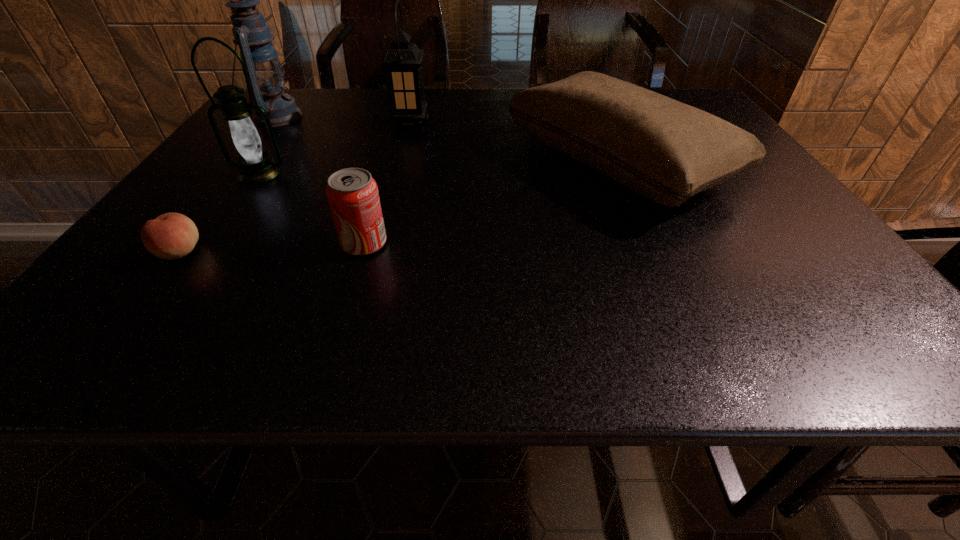
Where is `vacant region between the soda can and the nearest lantern`? vacant region between the soda can and the nearest lantern is located at coordinates (312, 208).

Identify the location of free space between the nearest lantern and the shortest object. The height and width of the screenshot is (540, 960). (220, 212).

Locate an element on the screen. Image resolution: width=960 pixels, height=540 pixels. object that stands as the closest to the cushion is located at coordinates (402, 62).

This screenshot has width=960, height=540. In order to click on object that is the fourth closest one to the shortest object in this screenshot , I will do `click(402, 62)`.

Identify which lantern is located as the third nearest to the shortest object. Please provide its 2D coordinates. Your answer should be formatted as a tuple, i.e. [(x, y)], where the tuple contains the x and y coordinates of a point satisfying the conditions above.

[(402, 62)]

This screenshot has width=960, height=540. Identify the location of lantern that is the closest to the shortest object. (255, 166).

The width and height of the screenshot is (960, 540). Identify the location of vacant space that satisfies the following two spatial constraints: 1. on the side where the nearest lantern emits light; 2. on the right side of the soda can. (211, 244).

Identify the location of free spot that satisfies the following two spatial constraints: 1. on the back side of the rightmost lantern; 2. on the left side of the soda can. This screenshot has width=960, height=540. (399, 123).

Where is `free region that satisfies the following two spatial constraints: 1. on the side where the soda can emits light; 2. on the left side of the nearest lantern`? The image size is (960, 540). free region that satisfies the following two spatial constraints: 1. on the side where the soda can emits light; 2. on the left side of the nearest lantern is located at coordinates (211, 244).